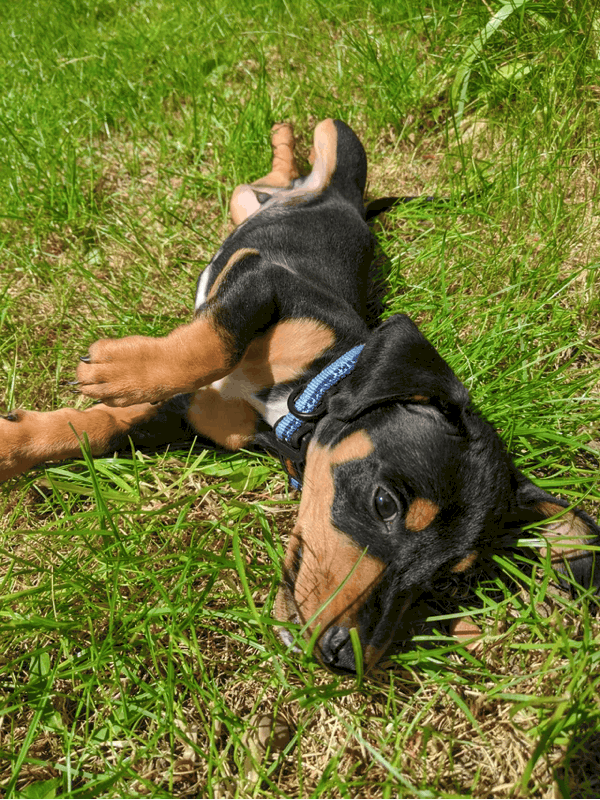
I want to click on chest, so click(x=286, y=248).